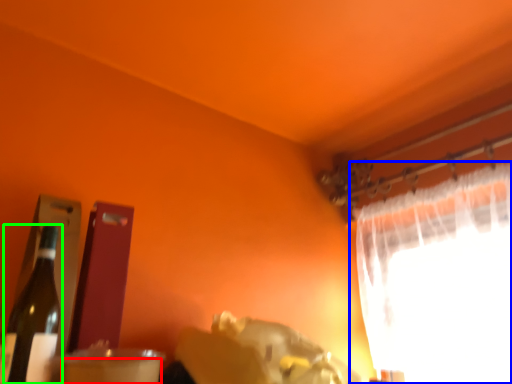
Question: Which is nearer to the drinking straw (highlighted by a red box)? curtain (highlighted by a blue box) or bottle (highlighted by a green box).

Choices:
 (A) curtain
 (B) bottle

Answer: (B)